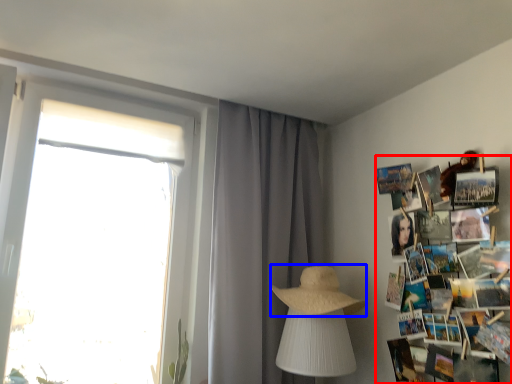
Question: Which of the following is the closest to the observer, magazine (highlighted by a red box) or straw hat (highlighted by a blue box)?

Choices:
 (A) magazine
 (B) straw hat

Answer: (A)